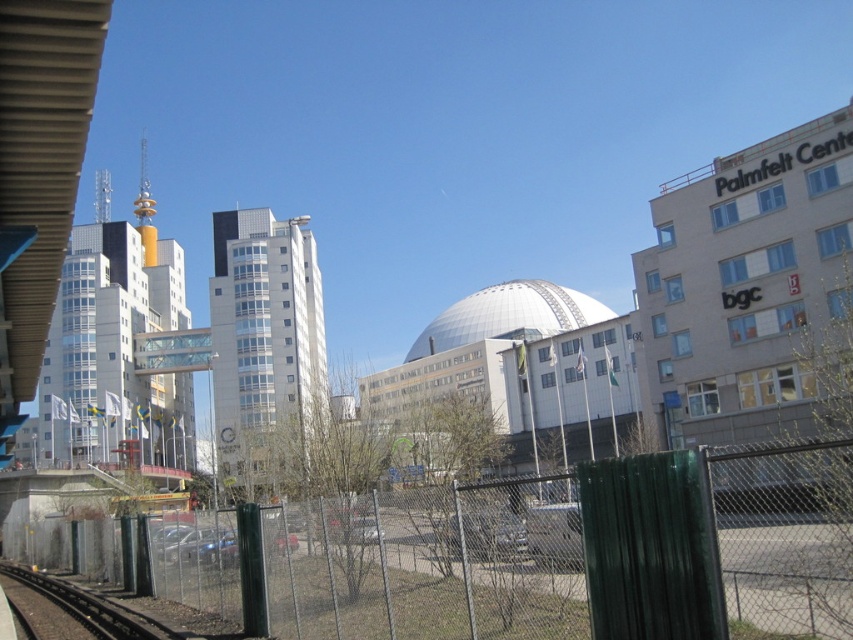
Question: Can you confirm if green chain-link fence at center is thinner than black metal train track at lower left?

Choices:
 (A) no
 (B) yes

Answer: (B)

Question: Which object appears closest to the camera in this image?

Choices:
 (A) black metal train track at lower left
 (B) green chain-link fence at center

Answer: (B)

Question: Is green chain-link fence at center thinner than black metal train track at lower left?

Choices:
 (A) yes
 (B) no

Answer: (A)

Question: Can you confirm if green chain-link fence at center is positioned to the left of black metal train track at lower left?

Choices:
 (A) yes
 (B) no

Answer: (B)

Question: Which of the following is the closest to the observer?

Choices:
 (A) black metal train track at lower left
 (B) green chain-link fence at center

Answer: (B)